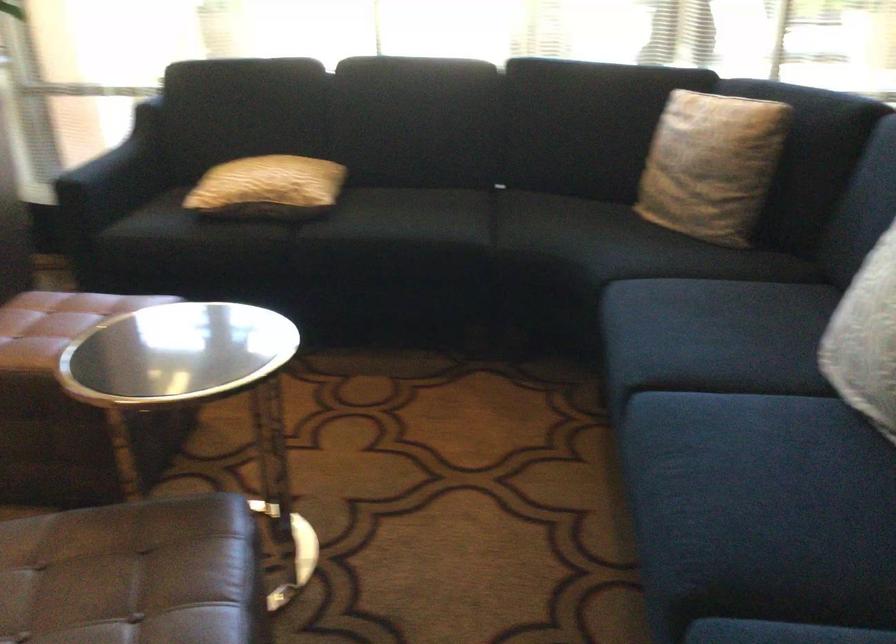
Find where to sit the dark sofa sitting surface. Please return your answer as a coordinate pair (x, y).

(745, 459)